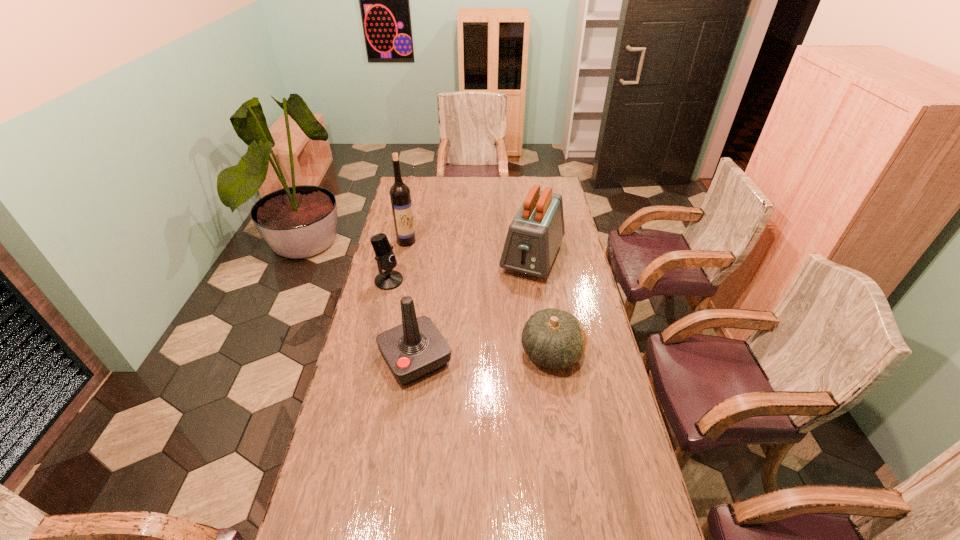
Find the location of a particular element. Image resolution: width=960 pixels, height=540 pixels. free space on the desktop that is between the joystick and the shortest object and is positioned on the stand of the second shortest object is located at coordinates (492, 355).

At what (x,y) coordinates should I click in order to perform the action: click on vacant space on the desktop that is between the joystick and the gourd and is positioned on the front-facing side of the toaster. Please return your answer as a coordinate pair (x, y). The width and height of the screenshot is (960, 540). Looking at the image, I should click on (487, 355).

Locate an element on the screen. free space on the desktop that is between the joystick and the shortest object and is positioned on the label of the tallest object is located at coordinates (502, 355).